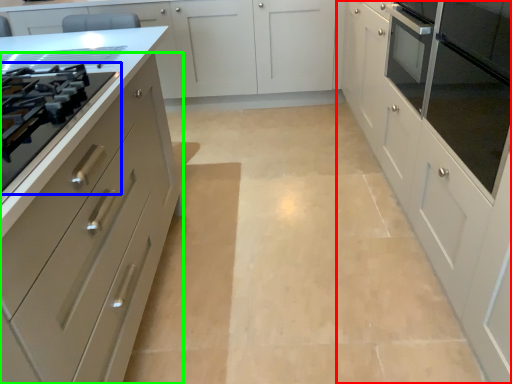
Question: Which object is positioned farthest from cabinetry (highlighted by a red box)? Select from drawer (highlighted by a blue box) and cabinetry (highlighted by a green box).

Choices:
 (A) drawer
 (B) cabinetry

Answer: (A)